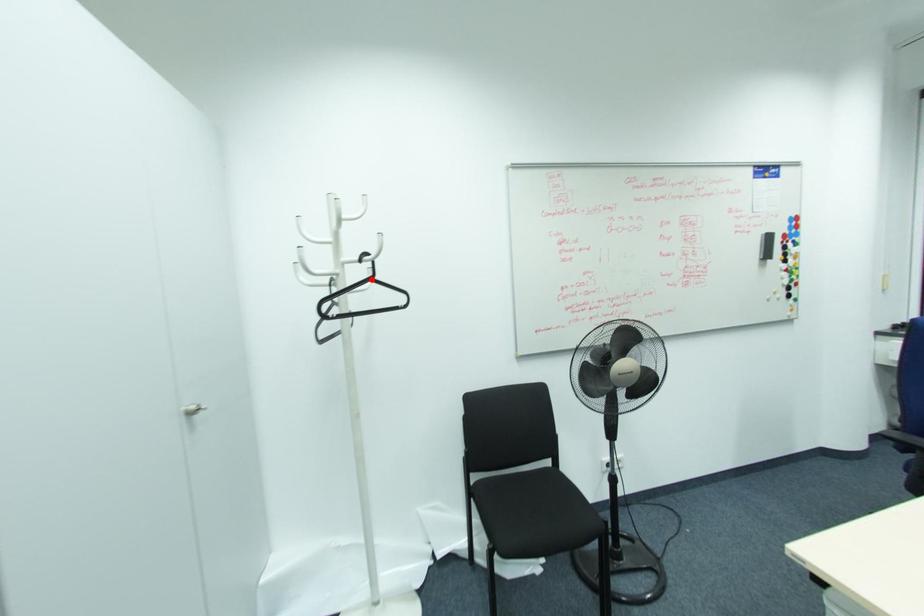
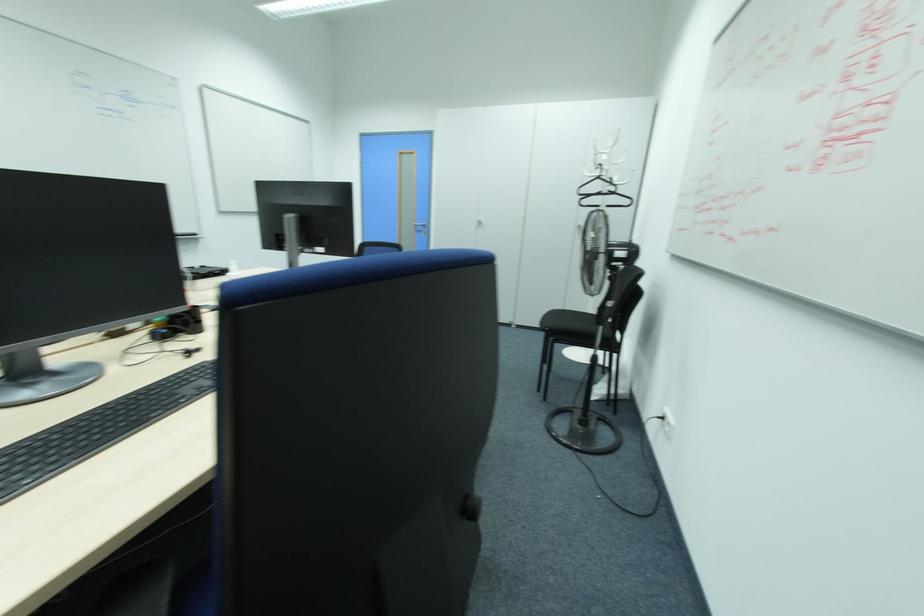
Locate, in the second image, the point that corresponds to the highlighted location in the first image.

(599, 177)